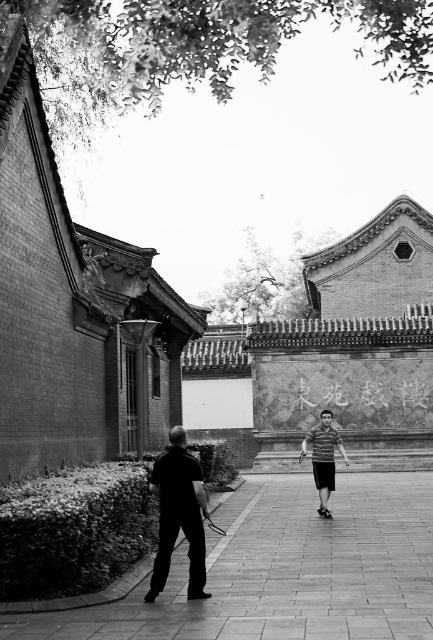
Does smooth concrete pavement at lower left appear on the left side of dark gray fabric shirt at center?

In fact, smooth concrete pavement at lower left is to the right of dark gray fabric shirt at center.

Describe the element at coordinates (286, 570) in the screenshot. This screenshot has width=433, height=640. I see `smooth concrete pavement at lower left` at that location.

Image resolution: width=433 pixels, height=640 pixels. What are the coordinates of `smooth concrete pavement at lower left` in the screenshot? It's located at (286, 570).

Does dark gray fabric shirt at center appear over striped fabric shirt at center?

Correct, dark gray fabric shirt at center is located above striped fabric shirt at center.

Locate an element on the screen. This screenshot has height=640, width=433. dark gray fabric shirt at center is located at coordinates (178, 515).

Which is in front, point (181, 433) or point (323, 420)?

Point (181, 433) is more forward.

The image size is (433, 640). Identify the location of dark gray fabric shirt at center. (178, 515).

Is point (303, 612) positioned after point (319, 492)?

No, it is in front of (319, 492).

Locate an element on the screen. smooth concrete pavement at lower left is located at coordinates (286, 570).